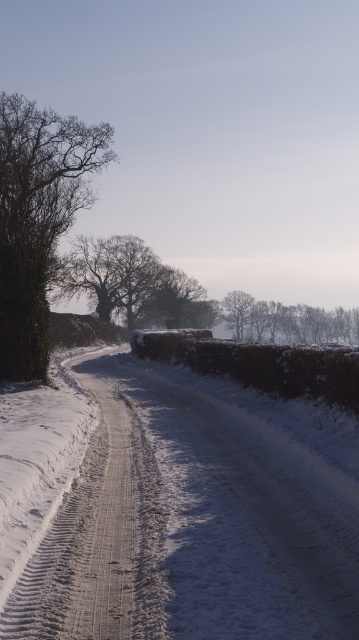
You are standing at the point marked as point (174, 508). Looking around, you see a snowy asphalt road at center. Which direction should you walk to reach the snowy asphalt road at center?

Since you are already at the point where the snowy asphalt road at center is located, you are already on the snowy asphalt road at center. There is no need to walk further in any direction.

You are a painter standing on the snow road. You want to paint the bare branches at left and the snowy bare trees at center. Which object has a wider spread in terms of width?

The snowy bare trees at center have a wider spread in terms of width than the bare branches at left.

You are a hiker trying to estimate distances in the winter landscape. You see the bare branches at left and the snowy bare trees at center. How far apart are these two landmarks from each other?

The bare branches at left and the snowy bare trees at center are 30.74 meters apart.